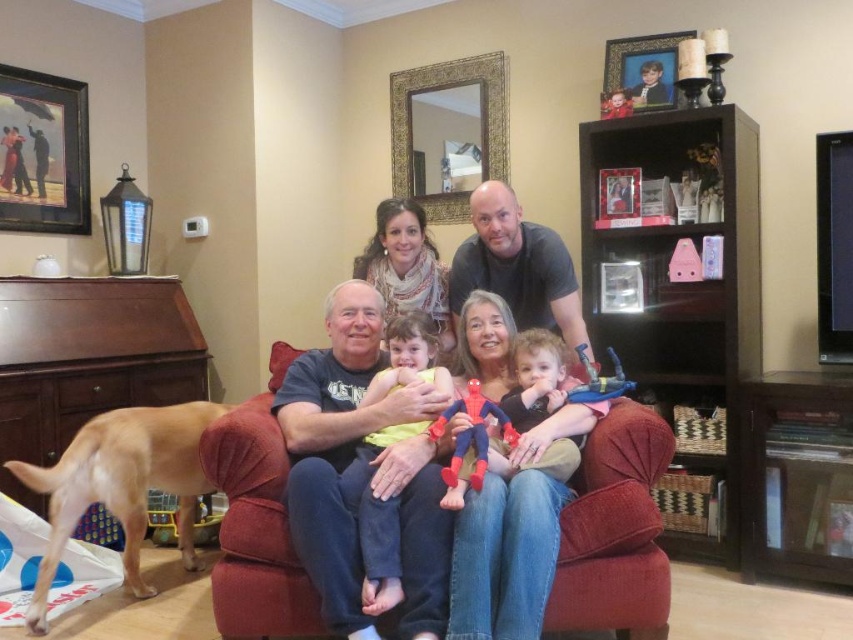
Question: Can you confirm if golden fur dog at lower left is smaller than blue fabric toy at center?

Choices:
 (A) no
 (B) yes

Answer: (A)

Question: Is matte blue jeans at center positioned before wooden picture frame at upper center?

Choices:
 (A) no
 (B) yes

Answer: (B)

Question: Does golden fur dog at lower left appear on the left side of red fabric spider-man at center?

Choices:
 (A) yes
 (B) no

Answer: (A)

Question: Which object is farther from the camera taking this photo?

Choices:
 (A) red fabric spider-man at center
 (B) matte black picture frame at upper left
 (C) golden fur dog at lower left

Answer: (B)

Question: Which point is farther from the camera taking this photo?

Choices:
 (A) (410, 429)
 (B) (578, 403)

Answer: (B)

Question: Which object is the closest to the red fabric spider-man at center?

Choices:
 (A) wooden picture frame at upper center
 (B) yellow matte shirt at center
 (C) matte blue jeans at center

Answer: (C)